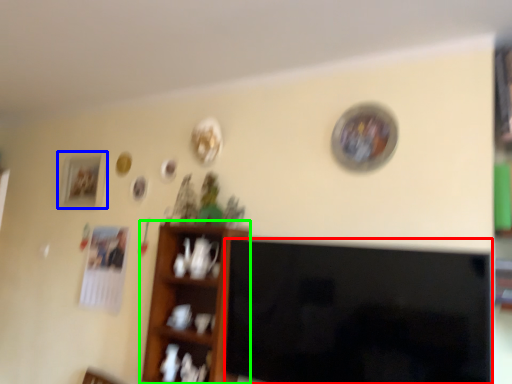
Question: Considering the real-world distances, which object is closest to television (highlighted by a red box)? picture frame (highlighted by a blue box) or shelf (highlighted by a green box).

Choices:
 (A) picture frame
 (B) shelf

Answer: (B)